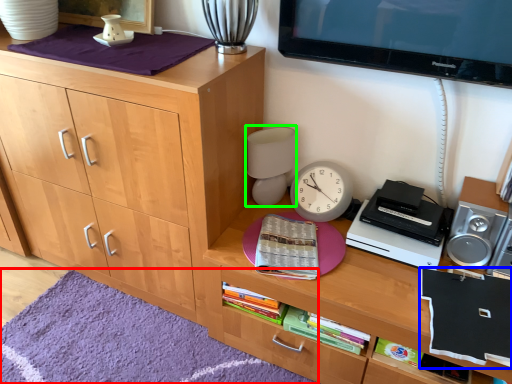
Question: Estimate the real-world distances between objects in this image. Which object is closer to mat (highlighted by a red box), book (highlighted by a blue box) or table lamp (highlighted by a green box)?

Choices:
 (A) book
 (B) table lamp

Answer: (B)